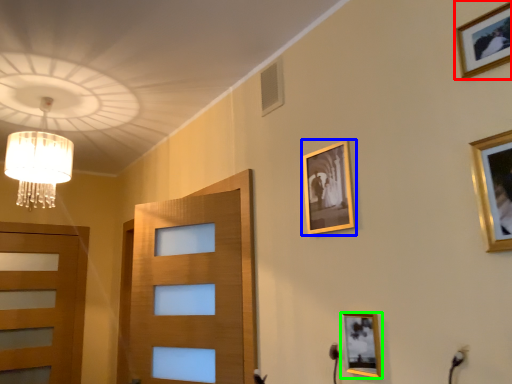
Question: Based on their relative distances, which object is nearer to picture frame (highlighted by a red box)? Choose from picture frame (highlighted by a blue box) and picture frame (highlighted by a green box).

Choices:
 (A) picture frame
 (B) picture frame

Answer: (A)